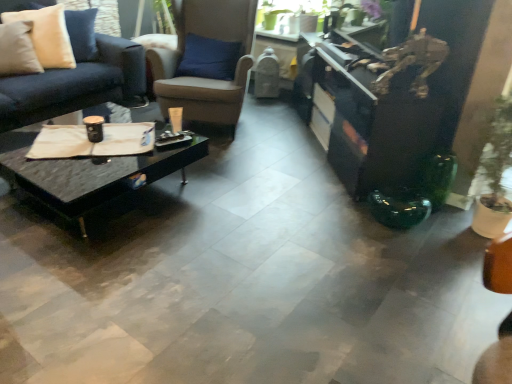
Question: Is beige fabric pillow at upper left bigger than black glossy entertainment center at right?

Choices:
 (A) no
 (B) yes

Answer: (A)

Question: Is beige fabric pillow at upper left next to black glossy entertainment center at right?

Choices:
 (A) no
 (B) yes

Answer: (A)

Question: From a real-world perspective, is beige fabric pillow at upper left physically above black glossy entertainment center at right?

Choices:
 (A) no
 (B) yes

Answer: (B)

Question: Considering the relative sizes of beige fabric pillow at upper left and black glossy entertainment center at right in the image provided, is beige fabric pillow at upper left shorter than black glossy entertainment center at right?

Choices:
 (A) yes
 (B) no

Answer: (A)

Question: Considering the relative sizes of beige fabric pillow at upper left and black glossy entertainment center at right in the image provided, is beige fabric pillow at upper left smaller than black glossy entertainment center at right?

Choices:
 (A) yes
 (B) no

Answer: (A)

Question: From the image's perspective, relative to beige fabric pillow at upper left, is black marble coffee table at center above or below?

Choices:
 (A) above
 (B) below

Answer: (B)

Question: From a real-world perspective, is black marble coffee table at center positioned above or below beige fabric pillow at upper left?

Choices:
 (A) above
 (B) below

Answer: (B)

Question: Based on their positions, is black marble coffee table at center located to the left or right of beige fabric pillow at upper left?

Choices:
 (A) right
 (B) left

Answer: (A)

Question: From their relative heights in the image, would you say black marble coffee table at center is taller or shorter than beige fabric pillow at upper left?

Choices:
 (A) short
 (B) tall

Answer: (A)

Question: Considering the relative positions of brown leather chair at center and black glossy entertainment center at right in the image provided, is brown leather chair at center to the left or to the right of black glossy entertainment center at right?

Choices:
 (A) left
 (B) right

Answer: (A)

Question: From a real-world perspective, relative to black glossy entertainment center at right, is brown leather chair at center vertically above or below?

Choices:
 (A) above
 (B) below

Answer: (A)

Question: Is brown leather chair at center bigger or smaller than black glossy entertainment center at right?

Choices:
 (A) small
 (B) big

Answer: (B)

Question: In terms of width, does brown leather chair at center look wider or thinner when compared to black glossy entertainment center at right?

Choices:
 (A) thin
 (B) wide

Answer: (B)

Question: Considering the positions of black marble coffee table at center and brown leather chair at center in the image, is black marble coffee table at center wider or thinner than brown leather chair at center?

Choices:
 (A) wide
 (B) thin

Answer: (A)

Question: From a real-world perspective, is black marble coffee table at center physically located above or below brown leather chair at center?

Choices:
 (A) below
 (B) above

Answer: (A)